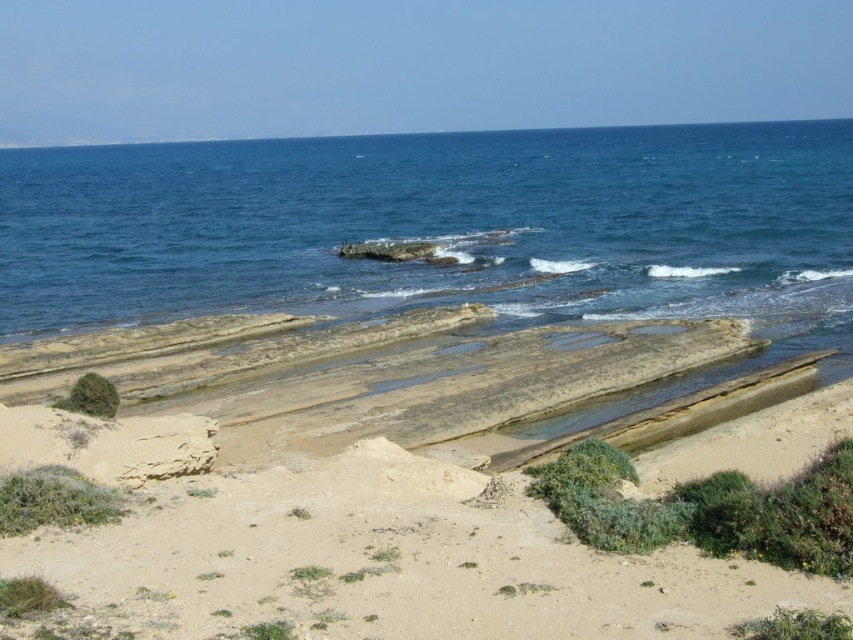
Question: Does blue water at center come in front of brown sandy beach at lower center?

Choices:
 (A) no
 (B) yes

Answer: (A)

Question: Can you confirm if blue water at center is bigger than brown sandy beach at lower center?

Choices:
 (A) yes
 (B) no

Answer: (A)

Question: Which object is closer to the camera taking this photo?

Choices:
 (A) brown sandy beach at lower center
 (B) blue water at center

Answer: (A)

Question: Is blue water at center positioned in front of brown sandy beach at lower center?

Choices:
 (A) no
 (B) yes

Answer: (A)

Question: Which point is closer to the camera taking this photo?

Choices:
 (A) (335, 493)
 (B) (521, 196)

Answer: (A)